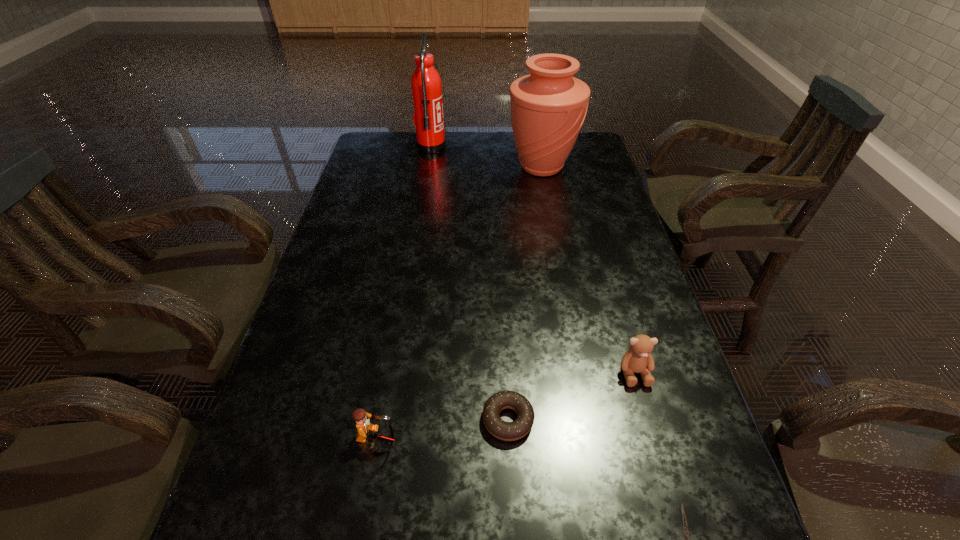
Find the location of a particular element. This screenshot has width=960, height=540. free location that satisfies the following two spatial constraints: 1. on the front side of the vase; 2. holding a crossbow in the hands of the Lego is located at coordinates (592, 440).